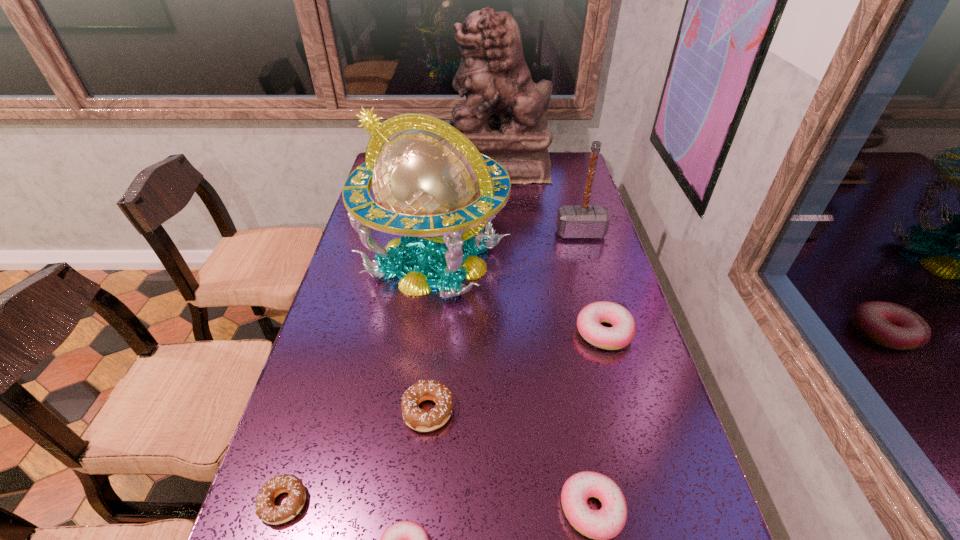
Identify the location of unoccupied area between the second tallest object and the leftmost doughnut. (359, 381).

Locate an element on the screen. The image size is (960, 540). the second closest object to the smallest pink doughnut is located at coordinates (418, 419).

Point out which object is positioned as the nearest to the right chocolate doughnut. Please provide its 2D coordinates. Your answer should be formatted as a tuple, i.e. [(x, y)], where the tuple contains the x and y coordinates of a point satisfying the conditions above.

[(405, 539)]

I want to click on doughnut identified as the fifth closest to the hammer, so click(x=265, y=509).

Select which doughnut appears as the second closest to the nearer chocolate doughnut. Please provide its 2D coordinates. Your answer should be formatted as a tuple, i.e. [(x, y)], where the tuple contains the x and y coordinates of a point satisfying the conditions above.

[(418, 419)]

This screenshot has width=960, height=540. Identify the location of the closest pink doughnut relative to the second farthest doughnut. (405, 539).

Locate an element on the screen. This screenshot has width=960, height=540. the second closest pink doughnut to the fourth nearest doughnut is located at coordinates (606, 523).

Locate an element on the screen. The height and width of the screenshot is (540, 960). free space that satisfies the following two spatial constraints: 1. on the back side of the farthest pink doughnut; 2. on the front-facing side of the sculpture is located at coordinates (559, 167).

This screenshot has width=960, height=540. I want to click on free space that satisfies the following two spatial constraints: 1. on the back side of the farthest doughnut; 2. on the front-facing side of the tallest object, so click(559, 167).

Identify the location of free location that satisfies the following two spatial constraints: 1. on the back side of the farther chocolate doughnut; 2. on the right side of the nearer chocolate doughnut. This screenshot has height=540, width=960. (313, 411).